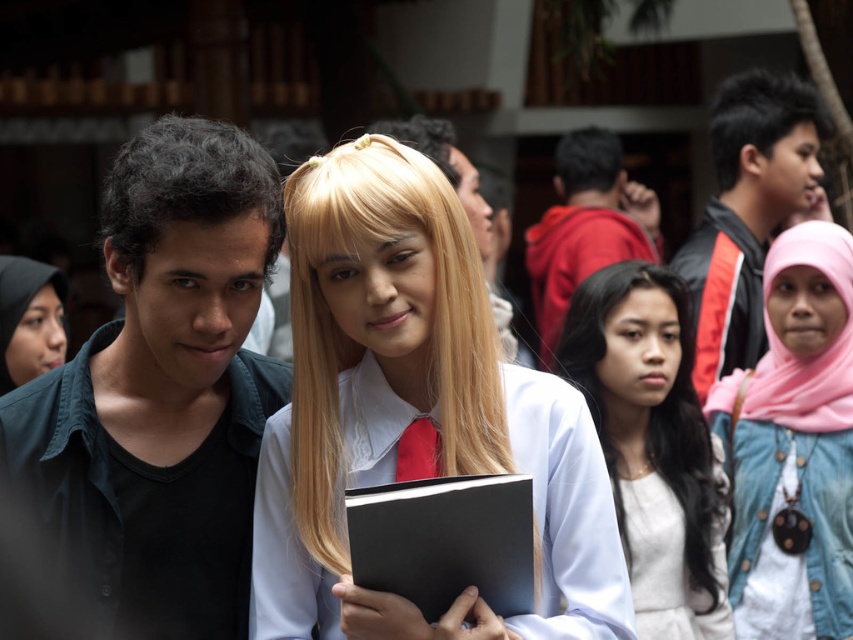
Question: Which object is farther from the camera taking this photo?

Choices:
 (A) blonde silky hair at center
 (B) smooth white blouse at center

Answer: (A)

Question: Which object is farther from the camera taking this photo?

Choices:
 (A) white matte uniform at center
 (B) matte black hijab at left
 (C) smooth white blouse at center
 (D) dark brown hair at upper right

Answer: (D)

Question: Which of the following is the closest to the observer?

Choices:
 (A) dark brown hair at left
 (B) red satin tie at center
 (C) pink fabric hijab at upper right
 (D) black jacket at right

Answer: (A)

Question: Where is dark green shirt at center located in relation to matte black hijab at left in the image?

Choices:
 (A) right
 (B) left

Answer: (A)

Question: Is white matte uniform at center further to the viewer compared to black jacket at right?

Choices:
 (A) no
 (B) yes

Answer: (A)

Question: Can you confirm if dark green shirt at center is positioned below dark brown hair at left?

Choices:
 (A) yes
 (B) no

Answer: (A)